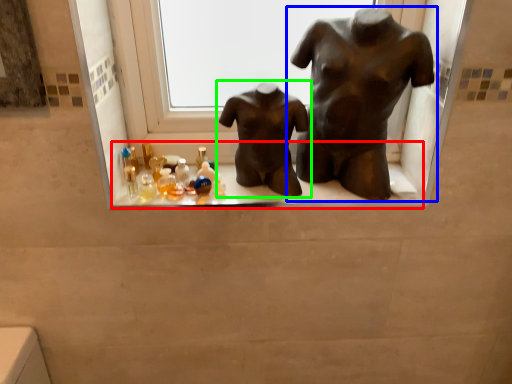
Question: Which is nearer to the window sill (highlighted by a red box)? statue (sculpture) (highlighted by a blue box) or statue (sculpture) (highlighted by a green box).

Choices:
 (A) statue (sculpture)
 (B) statue (sculpture)

Answer: (B)